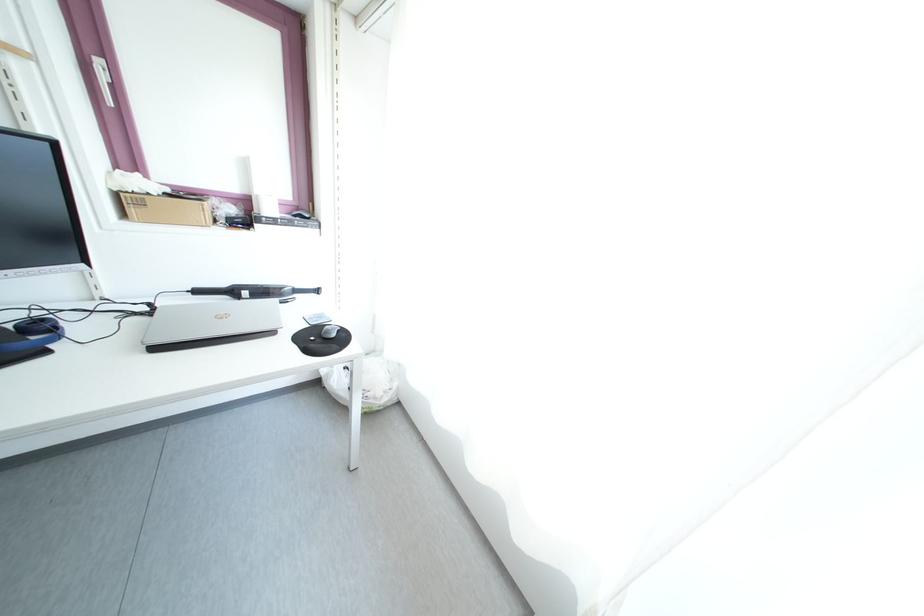
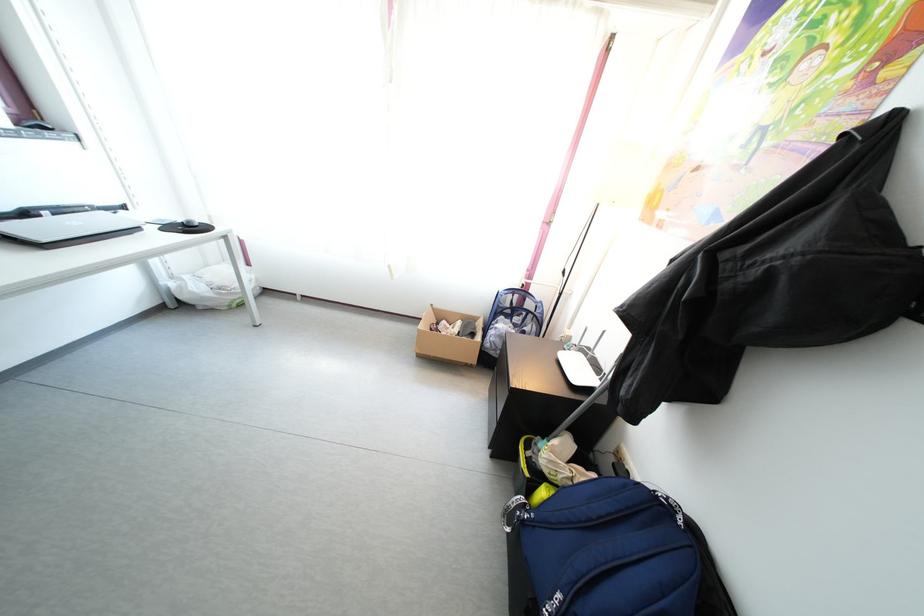
Locate, in the second image, the point that corresponds to [344,403] in the first image.

(210, 306)